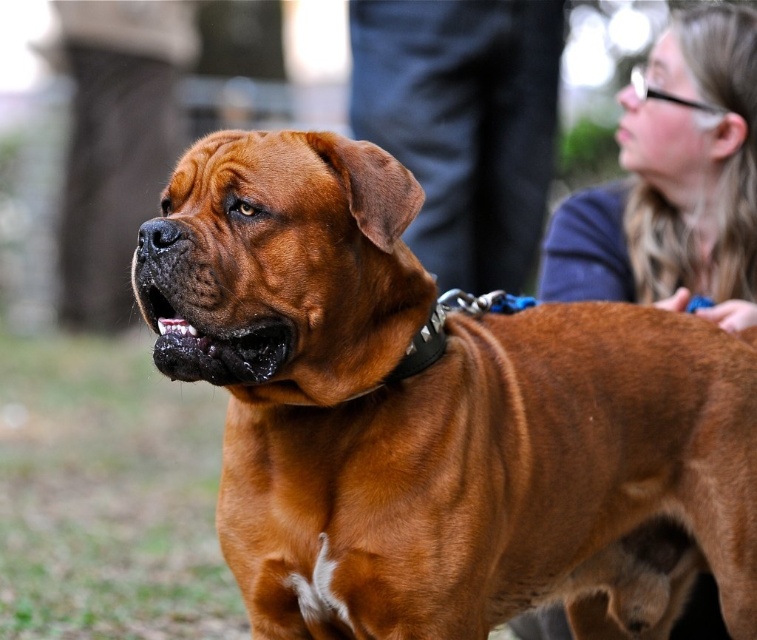
Question: Which point is farther to the camera?

Choices:
 (A) smooth blue shirt at upper right
 (B) brown leather dog at center

Answer: (A)

Question: Is brown leather dog at center bigger than smooth blue shirt at upper right?

Choices:
 (A) yes
 (B) no

Answer: (A)

Question: Does brown leather dog at center appear over smooth blue shirt at upper right?

Choices:
 (A) no
 (B) yes

Answer: (A)

Question: Which point appears closest to the camera in this image?

Choices:
 (A) (675, 218)
 (B) (324, 138)

Answer: (B)

Question: Observing the image, what is the correct spatial positioning of brown leather dog at center in reference to smooth blue shirt at upper right?

Choices:
 (A) below
 (B) above

Answer: (A)

Question: Which object is closer to the camera taking this photo?

Choices:
 (A) brown leather dog at center
 (B) smooth blue shirt at upper right

Answer: (A)